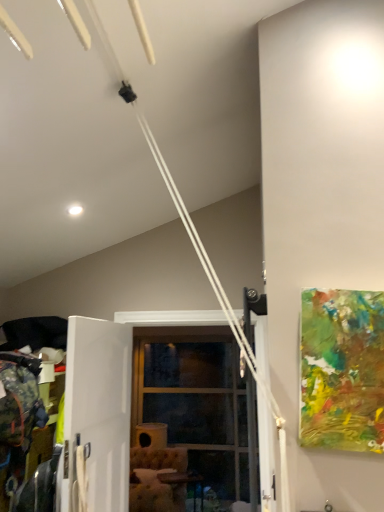
Question: Based on their positions, is clear glass door at center located to the left or right of white matte screen door at center?

Choices:
 (A) right
 (B) left

Answer: (A)

Question: Is clear glass door at center wider or thinner than white matte screen door at center?

Choices:
 (A) thin
 (B) wide

Answer: (B)

Question: Which is nearer to the white matte screen door at center?

Choices:
 (A) clear glass door at center
 (B) wooden table at lower center
 (C) abstract painting at right

Answer: (C)

Question: Estimate the real-world distances between objects in this image. Which object is closer to the abstract painting at right?

Choices:
 (A) white matte screen door at center
 (B) wooden table at lower center
 (C) clear glass door at center

Answer: (A)